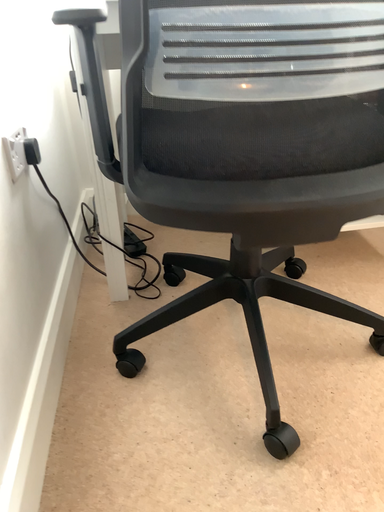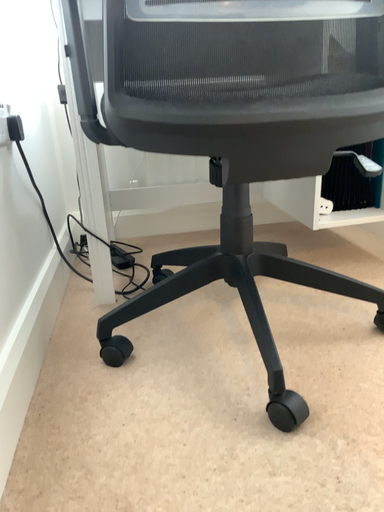
Question: Which way did the camera rotate in the video?

Choices:
 (A) rotated upward
 (B) rotated downward

Answer: (A)